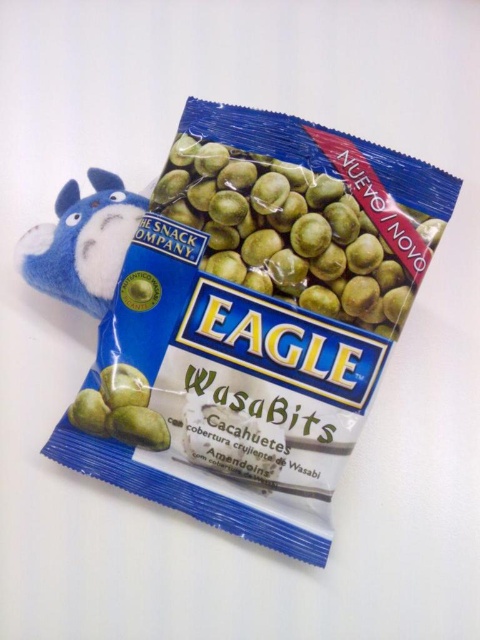
Can you confirm if green matte wasabits at center is shorter than blue plush toy at upper left?

In fact, green matte wasabits at center may be taller than blue plush toy at upper left.

Is green matte wasabits at center thinner than blue plush toy at upper left?

In fact, green matte wasabits at center might be wider than blue plush toy at upper left.

Who is more distant from viewer, (411, 291) or (41, 278)?

Point (41, 278)

Locate an element on the screen. The image size is (480, 640). green matte wasabits at center is located at coordinates click(301, 227).